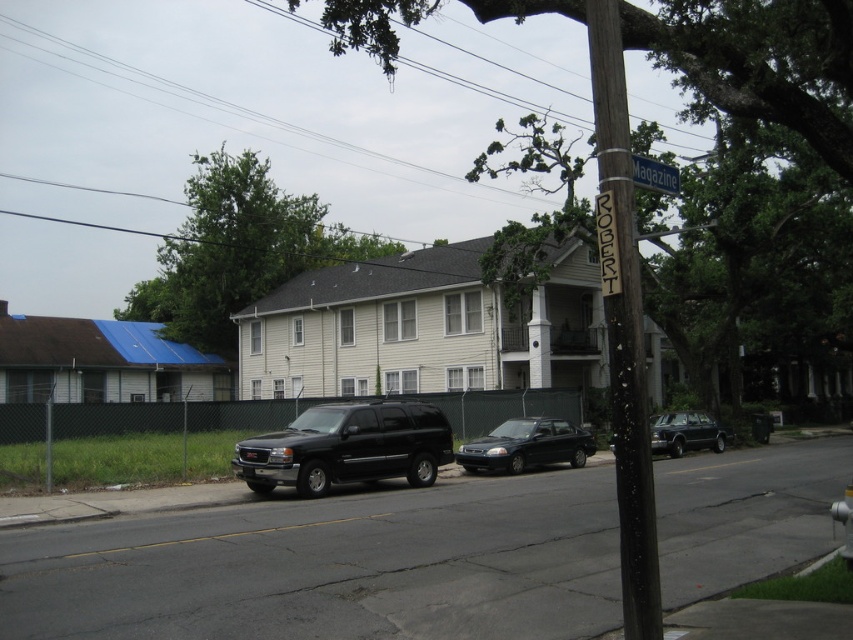
Which is below, shiny black sedan at center or shiny black limousine at center-right?

Positioned lower is shiny black sedan at center.

Between shiny black sedan at center and shiny black limousine at center-right, which one has less height?

shiny black sedan at center

Between point (538, 440) and point (651, 422), which one is positioned behind?

The point (651, 422) is more distant.

The height and width of the screenshot is (640, 853). What are the coordinates of `shiny black sedan at center` in the screenshot? It's located at (526, 445).

Can you confirm if black matte suv at center is smaller than shiny black sedan at center?

Yes.

Which is above, black matte suv at center or shiny black sedan at center?

black matte suv at center is above.

Identify the location of black matte suv at center. This screenshot has width=853, height=640. (347, 448).

Which of these two, shiny black sedan at center or green metallic street sign at upper center, stands shorter?

Standing shorter between the two is green metallic street sign at upper center.

Does shiny black sedan at center lie behind green metallic street sign at upper center?

Yes.

Where is `shiny black sedan at center`? This screenshot has width=853, height=640. shiny black sedan at center is located at coordinates (526, 445).